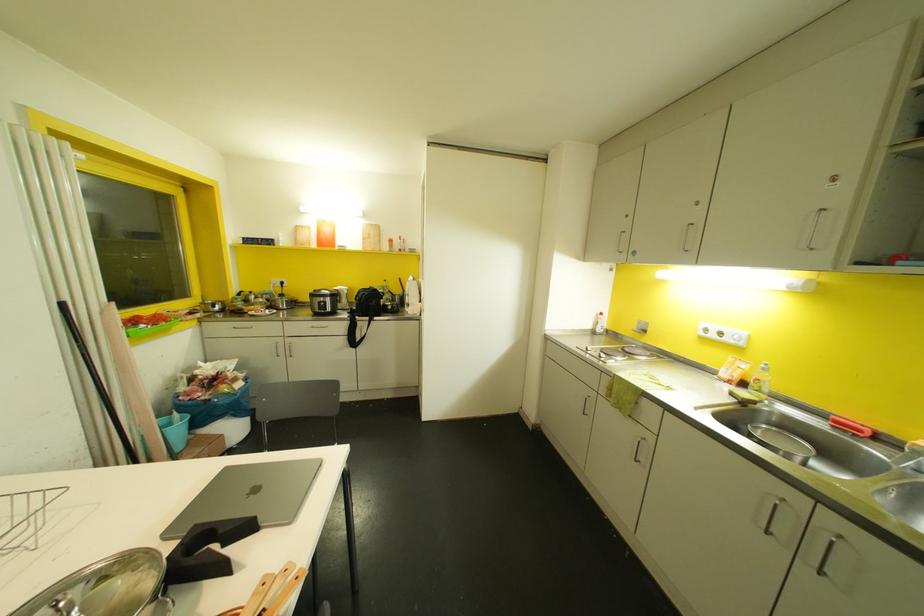
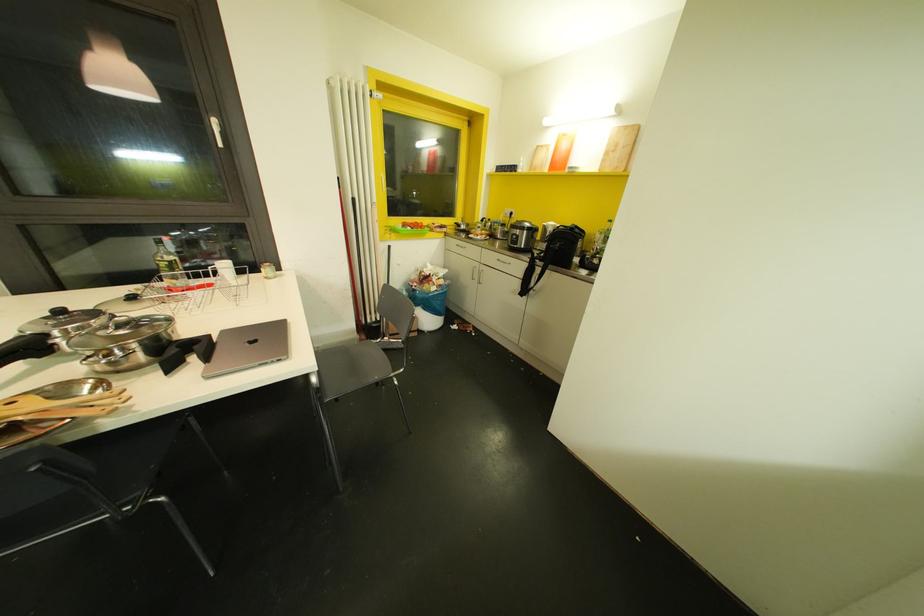
Question: I am providing you with two images of the same scene from different viewpoints. Please identify which objects are invisible in image2.

Choices:
 (A) chair sitting surface
 (B) glass oil bottle
 (C) black pot handle
 (D) none of these

Answer: (D)